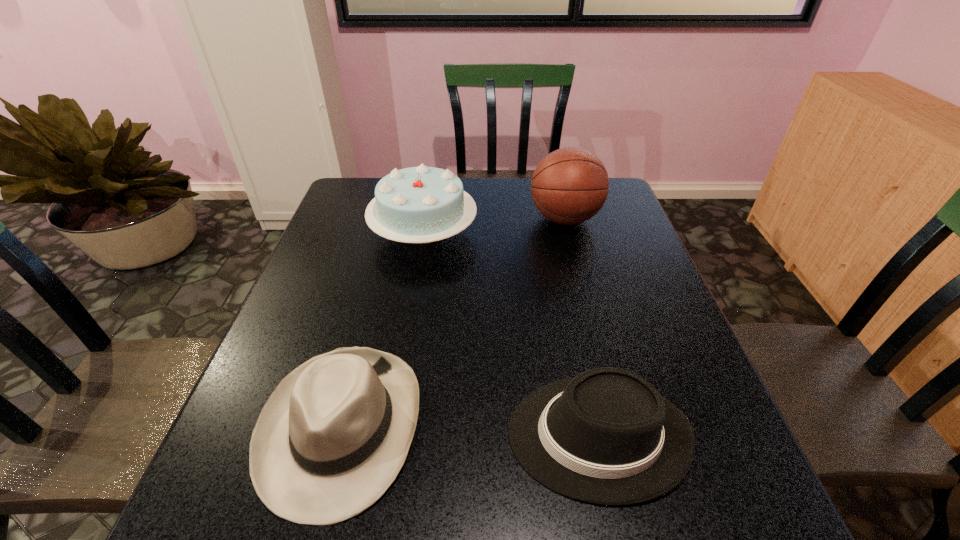
At what (x,y) coordinates should I click in order to perform the action: click on vacant space at the left edge. Please return your answer as a coordinate pair (x, y). The width and height of the screenshot is (960, 540). Looking at the image, I should click on (350, 236).

At what (x,y) coordinates should I click in order to perform the action: click on free space at the right edge of the desktop. Please return your answer as a coordinate pair (x, y). Image resolution: width=960 pixels, height=540 pixels. Looking at the image, I should click on (641, 341).

At what (x,y) coordinates should I click in order to perform the action: click on free space at the far left corner. Please return your answer as a coordinate pair (x, y). Looking at the image, I should click on (360, 199).

Locate an element on the screen. This screenshot has width=960, height=540. free space at the near left corner of the desktop is located at coordinates (x=259, y=510).

Find the location of a particular element. The width and height of the screenshot is (960, 540). free space between the basketball and the birthday cake is located at coordinates (494, 226).

Where is `free space between the right fedora and the birthday cake`? The height and width of the screenshot is (540, 960). free space between the right fedora and the birthday cake is located at coordinates [511, 334].

Where is `free point between the second tallest object and the left fedora`? This screenshot has height=540, width=960. free point between the second tallest object and the left fedora is located at coordinates (382, 330).

Locate an element on the screen. The width and height of the screenshot is (960, 540). empty location between the right fedora and the basketball is located at coordinates (582, 327).

Where is `free space between the left fedora and the basketball`? free space between the left fedora and the basketball is located at coordinates (453, 323).

Identify the location of free spot between the basketball and the birthday cake. The height and width of the screenshot is (540, 960). (494, 226).